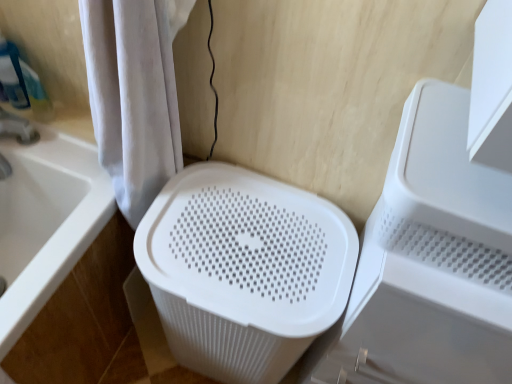
Question: From the image's perspective, is white plastic bathtub at lower left above or below white plastic basket at center?

Choices:
 (A) above
 (B) below

Answer: (A)

Question: Considering the positions of white plastic bathtub at lower left and white plastic basket at center in the image, is white plastic bathtub at lower left wider or thinner than white plastic basket at center?

Choices:
 (A) thin
 (B) wide

Answer: (B)

Question: Estimate the real-world distances between objects in this image. Which object is closer to the white plastic bathtub at lower left?

Choices:
 (A) velvet white shower curtain at left
 (B) white plastic basket at center
 (C) white plastic laundry basket at center

Answer: (A)

Question: Estimate the real-world distances between objects in this image. Which object is farther from the white plastic laundry basket at center?

Choices:
 (A) velvet white shower curtain at left
 (B) white plastic basket at center
 (C) white plastic bathtub at lower left

Answer: (C)